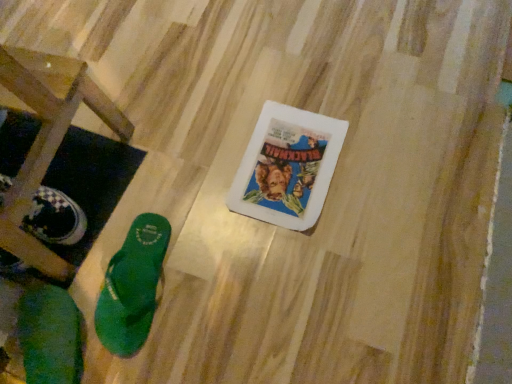
Find the location of a particular element. The height and width of the screenshot is (384, 512). vacant space to the right of green fabric flip-flop at lower left, the second footwear viewed from the right is located at coordinates (160, 336).